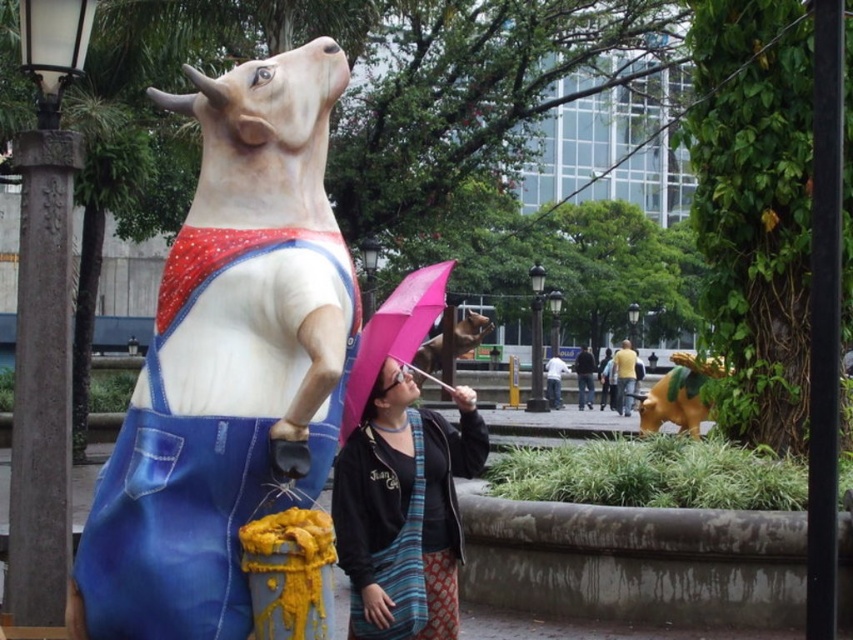
Question: Which of these objects is positioned farthest from the stone lamp post at left?

Choices:
 (A) black metal lamp post at center
 (B) matte black jacket at center

Answer: (A)

Question: Among these points, which one is nearest to the camera?

Choices:
 (A) (428, 560)
 (B) (480, 339)
 (C) (619, 406)

Answer: (A)

Question: Which point appears farthest from the camera in this image?

Choices:
 (A) (578, 404)
 (B) (624, 371)
 (C) (398, 301)

Answer: (A)

Question: Can you confirm if shiny brown dog at center is smaller than yellow fabric shirt at center?

Choices:
 (A) yes
 (B) no

Answer: (B)

Question: In this image, where is stone lamp post at left located relative to pink matte umbrella at center?

Choices:
 (A) right
 (B) left

Answer: (B)

Question: Does white glossy statue at upper left have a smaller size compared to white matte shirt at center?

Choices:
 (A) yes
 (B) no

Answer: (A)